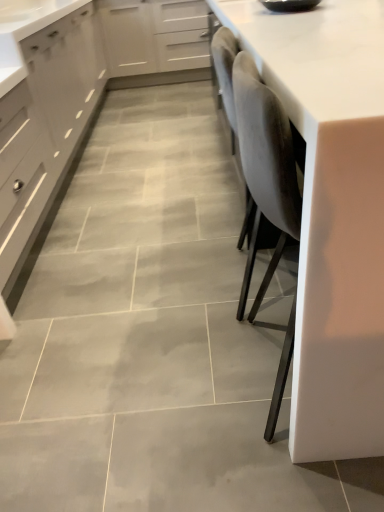
Question: Does white glossy countertop at right lie behind matte gray cabinet at left, acting as the second cabinetry starting from the right?

Choices:
 (A) yes
 (B) no

Answer: (B)

Question: Could you tell me if white glossy countertop at right is facing matte gray cabinet at left, which ranks as the 1th cabinetry in left-to-right order?

Choices:
 (A) no
 (B) yes

Answer: (A)

Question: Is matte gray cabinet at left, which ranks as the 1th cabinetry in left-to-right order, completely or partially inside white glossy countertop at right?

Choices:
 (A) yes
 (B) no

Answer: (B)

Question: Is there a large distance between white glossy countertop at right and matte gray cabinet at left, acting as the second cabinetry starting from the right?

Choices:
 (A) no
 (B) yes

Answer: (B)

Question: From the image's perspective, is white glossy countertop at right on matte gray cabinet at left, which ranks as the 1th cabinetry in left-to-right order?

Choices:
 (A) no
 (B) yes

Answer: (A)

Question: In terms of size, does matte gray cabinet at left, acting as the second cabinetry starting from the right, appear bigger or smaller than matte gray drawer at left?

Choices:
 (A) big
 (B) small

Answer: (A)

Question: Is matte gray cabinet at left, which ranks as the 1th cabinetry in left-to-right order, wider or thinner than matte gray drawer at left?

Choices:
 (A) wide
 (B) thin

Answer: (A)

Question: Is matte gray cabinet at left, acting as the second cabinetry starting from the right, in front of or behind matte gray drawer at left in the image?

Choices:
 (A) behind
 (B) front

Answer: (A)

Question: From their relative heights in the image, would you say matte gray cabinet at left, which ranks as the 1th cabinetry in left-to-right order, is taller or shorter than matte gray drawer at left?

Choices:
 (A) tall
 (B) short

Answer: (A)

Question: From the image's perspective, is white matte cabinet at upper center, the first cabinetry viewed from the right, positioned above or below white glossy countertop at right?

Choices:
 (A) below
 (B) above

Answer: (B)

Question: Looking at their shapes, would you say white matte cabinet at upper center, the first cabinetry viewed from the right, is wider or thinner than white glossy countertop at right?

Choices:
 (A) thin
 (B) wide

Answer: (A)

Question: Does point (119, 26) appear closer or farther from the camera than point (251, 2)?

Choices:
 (A) closer
 (B) farther

Answer: (B)

Question: From their relative heights in the image, would you say white matte cabinet at upper center, the first cabinetry viewed from the right, is taller or shorter than white glossy countertop at right?

Choices:
 (A) tall
 (B) short

Answer: (B)

Question: From the image's perspective, is matte gray drawer at left positioned above or below matte gray cabinet at left, acting as the second cabinetry starting from the right?

Choices:
 (A) below
 (B) above

Answer: (A)

Question: Is point (13, 231) positioned closer to the camera than point (86, 73)?

Choices:
 (A) closer
 (B) farther

Answer: (A)